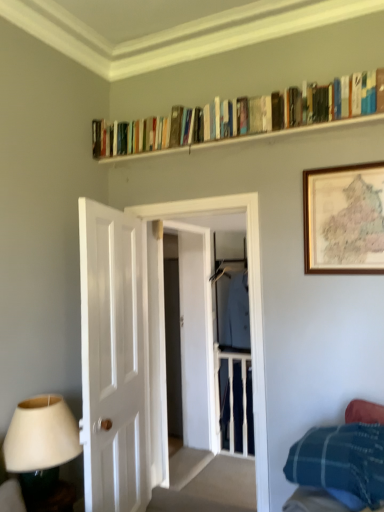
Question: From the image's perspective, does light blue fabric coat at center appear higher than white glossy door at left?

Choices:
 (A) no
 (B) yes

Answer: (A)

Question: Considering the relative sizes of light blue fabric coat at center and white glossy door at left in the image provided, is light blue fabric coat at center smaller than white glossy door at left?

Choices:
 (A) yes
 (B) no

Answer: (A)

Question: Is the position of light blue fabric coat at center more distant than that of white glossy door at left?

Choices:
 (A) no
 (B) yes

Answer: (B)

Question: Considering the relative sizes of light blue fabric coat at center and white glossy door at left in the image provided, is light blue fabric coat at center bigger than white glossy door at left?

Choices:
 (A) no
 (B) yes

Answer: (A)

Question: Is light blue fabric coat at center wider than white glossy door at left?

Choices:
 (A) no
 (B) yes

Answer: (A)

Question: From a real-world perspective, is wooden bookshelf at upper center above or below wooden framed map at upper right?

Choices:
 (A) below
 (B) above

Answer: (B)

Question: Is wooden bookshelf at upper center taller or shorter than wooden framed map at upper right?

Choices:
 (A) short
 (B) tall

Answer: (A)

Question: Based on their positions, is wooden bookshelf at upper center located to the left or right of wooden framed map at upper right?

Choices:
 (A) right
 (B) left

Answer: (B)

Question: Do you think wooden bookshelf at upper center is within wooden framed map at upper right, or outside of it?

Choices:
 (A) outside
 (B) inside

Answer: (A)

Question: Visually, is hardcover books at upper center positioned to the left or to the right of transparent glass door at center?

Choices:
 (A) right
 (B) left

Answer: (A)

Question: Is hardcover books at upper center in front of or behind transparent glass door at center in the image?

Choices:
 (A) front
 (B) behind

Answer: (A)

Question: Looking at their shapes, would you say hardcover books at upper center is wider or thinner than transparent glass door at center?

Choices:
 (A) thin
 (B) wide

Answer: (A)

Question: From the image's perspective, is hardcover books at upper center positioned above or below transparent glass door at center?

Choices:
 (A) above
 (B) below

Answer: (A)

Question: Is matte white lampshade at lower left bigger or smaller than white glossy door at left?

Choices:
 (A) big
 (B) small

Answer: (B)

Question: From a real-world perspective, relative to white glossy door at left, is matte white lampshade at lower left vertically above or below?

Choices:
 (A) above
 (B) below

Answer: (B)